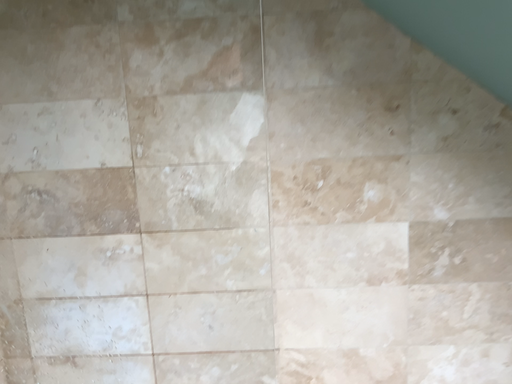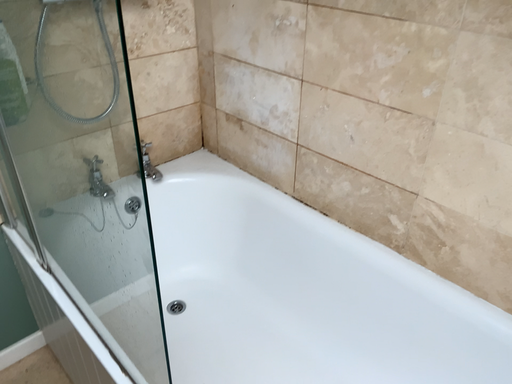
Question: Which way did the camera rotate in the video?

Choices:
 (A) rotated downward
 (B) rotated upward

Answer: (A)